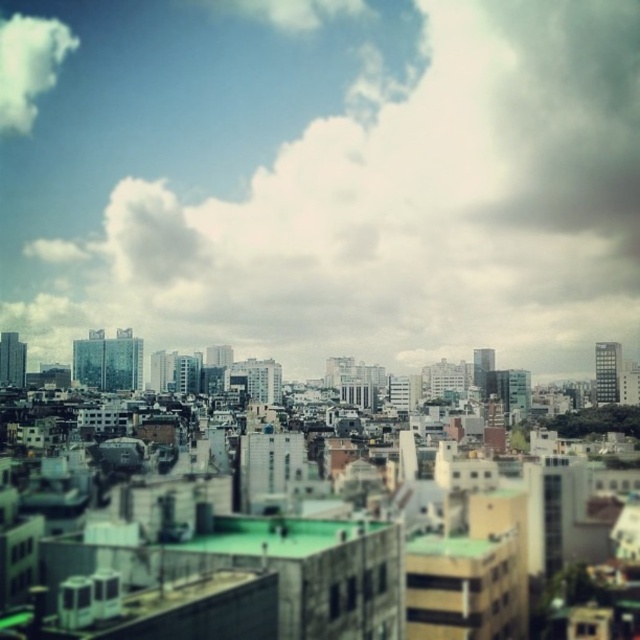
You are an architect observing the cityscape and want to determine the relative positions of the clouds. Which cloud is closer to the ground, the white fluffy cloud at upper center or the white fluffy cloud at upper left?

The white fluffy cloud at upper center is positioned under the white fluffy cloud at upper left, so it is closer to the ground.